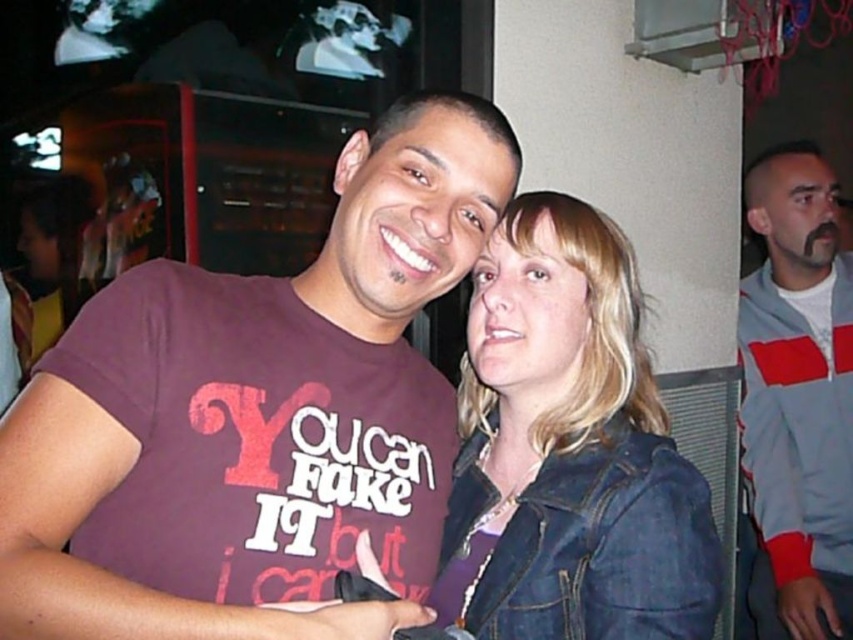
Is purple cotton t-shirt at center above denim jacket at center?

Indeed, purple cotton t-shirt at center is positioned over denim jacket at center.

This screenshot has width=853, height=640. Find the location of `purple cotton t-shirt at center`. purple cotton t-shirt at center is located at coordinates (113, 561).

Which is in front, point (422, 170) or point (657, 579)?

Positioned in front is point (657, 579).

This screenshot has height=640, width=853. I want to click on purple cotton t-shirt at center, so click(x=113, y=561).

Who is more distant from viewer, (138, 627) or (817, 611)?

The point (817, 611) is more distant.

Who is more forward, (341, 525) or (762, 317)?

Point (341, 525)

Locate an element on the screen. purple cotton t-shirt at center is located at coordinates (113, 561).

The height and width of the screenshot is (640, 853). Identify the location of purple cotton t-shirt at center. (113, 561).

Is denim jacket at center to the right of gray/red zip-up jacket at right from the viewer's perspective?

No, denim jacket at center is not to the right of gray/red zip-up jacket at right.

What do you see at coordinates (569, 451) in the screenshot? I see `denim jacket at center` at bounding box center [569, 451].

You are a GUI agent. You are given a task and a screenshot of the screen. Output one action in this format:
    pyautogui.click(x=<x>, y=<y>)
    Task: Click on the denim jacket at center
    This screenshot has width=853, height=640.
    Given the screenshot: What is the action you would take?
    pyautogui.click(x=569, y=451)